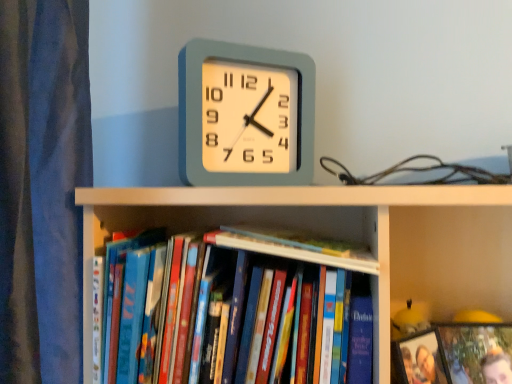
Question: Is hardcover book at center, positioned as the 2th book in left-to-right order, positioned with its back to matte plastic photo frame at lower right, which ranks as the first book in right-to-left order?

Choices:
 (A) yes
 (B) no

Answer: (B)

Question: Considering the relative sizes of hardcover book at center, which is the second book in right-to-left order, and matte plastic photo frame at lower right, the third book when ordered from left to right, in the image provided, is hardcover book at center, which is the second book in right-to-left order, bigger than matte plastic photo frame at lower right, the third book when ordered from left to right,?

Choices:
 (A) yes
 (B) no

Answer: (B)

Question: From a real-world perspective, is hardcover book at center, positioned as the 2th book in left-to-right order, below matte plastic photo frame at lower right, which ranks as the first book in right-to-left order?

Choices:
 (A) no
 (B) yes

Answer: (A)

Question: From a real-world perspective, is hardcover book at center, which is the second book in right-to-left order, on top of matte plastic photo frame at lower right, which ranks as the first book in right-to-left order?

Choices:
 (A) yes
 (B) no

Answer: (A)

Question: From the image's perspective, does hardcover book at center, positioned as the 2th book in left-to-right order, appear higher than matte plastic photo frame at lower right, which ranks as the first book in right-to-left order?

Choices:
 (A) no
 (B) yes

Answer: (B)

Question: Considering the relative positions of hardcover book at center, positioned as the 2th book in left-to-right order, and matte plastic photo frame at lower right, which ranks as the first book in right-to-left order, in the image provided, is hardcover book at center, positioned as the 2th book in left-to-right order, to the left of matte plastic photo frame at lower right, which ranks as the first book in right-to-left order, from the viewer's perspective?

Choices:
 (A) no
 (B) yes

Answer: (B)

Question: Does matte plastic clock at center have a greater height compared to hardcover book at center, which is the second book in right-to-left order?

Choices:
 (A) yes
 (B) no

Answer: (A)

Question: Can you confirm if matte plastic clock at center is positioned to the left of hardcover book at center, which is the second book in right-to-left order?

Choices:
 (A) yes
 (B) no

Answer: (A)

Question: Is matte plastic clock at center at the right side of hardcover book at center, positioned as the 2th book in left-to-right order?

Choices:
 (A) yes
 (B) no

Answer: (B)

Question: Can you see matte plastic clock at center touching hardcover book at center, which is the second book in right-to-left order?

Choices:
 (A) yes
 (B) no

Answer: (B)

Question: Is matte plastic clock at center positioned with its back to hardcover book at center, which is the second book in right-to-left order?

Choices:
 (A) yes
 (B) no

Answer: (B)

Question: From a real-world perspective, is matte plastic clock at center physically below hardcover book at center, positioned as the 2th book in left-to-right order?

Choices:
 (A) yes
 (B) no

Answer: (B)

Question: Considering the relative positions of hardcover book at center, positioned as the 2th book in left-to-right order, and wooden photo frame at lower right in the image provided, is hardcover book at center, positioned as the 2th book in left-to-right order, behind wooden photo frame at lower right?

Choices:
 (A) no
 (B) yes

Answer: (B)